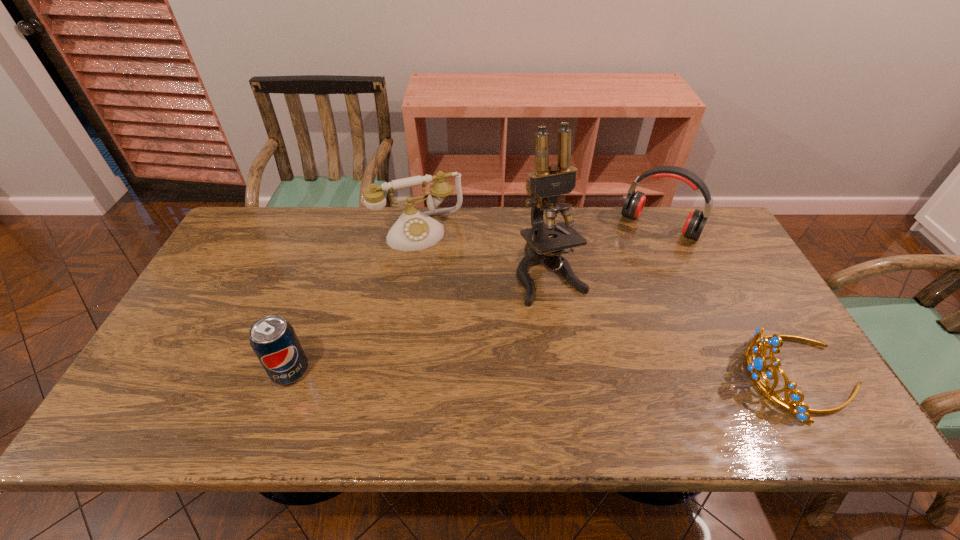
Locate an element on the screen. The width and height of the screenshot is (960, 540). the leftmost object is located at coordinates (274, 341).

In order to click on tiara in this screenshot , I will do `click(755, 369)`.

The height and width of the screenshot is (540, 960). I want to click on the tallest object, so click(549, 181).

The width and height of the screenshot is (960, 540). Identify the location of the third object from right to left. (549, 181).

Find the location of a particular element. Image resolution: width=960 pixels, height=540 pixels. the fourth object from right to left is located at coordinates (414, 230).

Where is `earphone`? earphone is located at coordinates click(x=634, y=203).

Image resolution: width=960 pixels, height=540 pixels. I want to click on vacant space situated 0.330m on the right of the leftmost object, so (x=445, y=372).

Identify the location of free spot located 0.110m on the front-facing side of the tiara. click(700, 376).

The image size is (960, 540). In order to click on free spot located 0.190m on the front-facing side of the tiara in this screenshot , I will do `click(667, 376)`.

The width and height of the screenshot is (960, 540). Find the location of `vacant space located 0.360m on the front-facing side of the tiara`. vacant space located 0.360m on the front-facing side of the tiara is located at coordinates (595, 376).